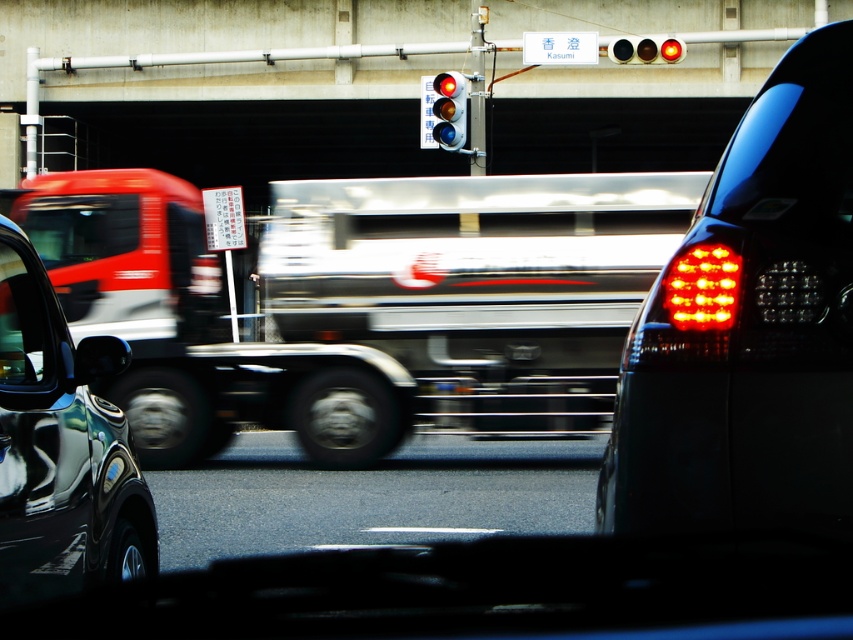
Does asphalt at center have a lesser width compared to shiny black car at left?

No, asphalt at center is not thinner than shiny black car at left.

Is asphalt at center further to the viewer compared to shiny black car at left?

Yes.

Find the location of a particular element. asphalt at center is located at coordinates (370, 497).

You are a GUI agent. You are given a task and a screenshot of the screen. Output one action in this format:
    pyautogui.click(x=<x>, y=<y>)
    Task: Click on the asphalt at center
    
    Given the screenshot: What is the action you would take?
    pyautogui.click(x=370, y=497)

Is shiny black car at left to the left of red glass traffic light at upper center from the viewer's perspective?

Correct, you'll find shiny black car at left to the left of red glass traffic light at upper center.

Can you confirm if shiny black car at left is positioned above red glass traffic light at upper center?

Incorrect, shiny black car at left is not positioned above red glass traffic light at upper center.

The width and height of the screenshot is (853, 640). Describe the element at coordinates (61, 448) in the screenshot. I see `shiny black car at left` at that location.

Where is `shiny black car at left`? shiny black car at left is located at coordinates (61, 448).

The width and height of the screenshot is (853, 640). What do you see at coordinates (750, 328) in the screenshot? I see `matte black car at right` at bounding box center [750, 328].

Can you confirm if matte black car at right is thinner than asphalt at center?

Yes, matte black car at right is thinner than asphalt at center.

Identify the location of matte black car at right. This screenshot has height=640, width=853. (750, 328).